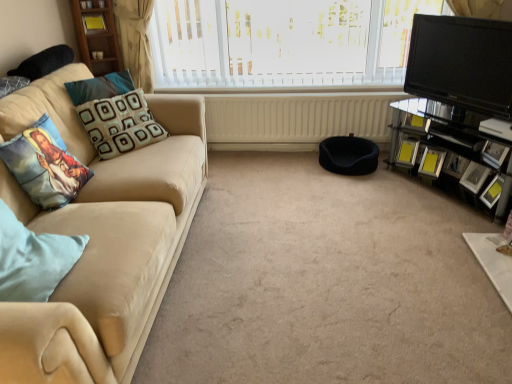
Question: From the image's perspective, does printed fabric pillow at left, placed as the 2th pillow when sorted from front to back, appear lower than matte black picture frame at right, which is the 3th picture frame from back to front?

Choices:
 (A) yes
 (B) no

Answer: (B)

Question: Is printed fabric pillow at left, placed as the 2th pillow when sorted from front to back, not close to matte black picture frame at right, which is the 3th picture frame from back to front?

Choices:
 (A) no
 (B) yes

Answer: (B)

Question: Is printed fabric pillow at left, placed as the 2th pillow when sorted from front to back, facing towards matte black picture frame at right, which is the 3th picture frame from back to front?

Choices:
 (A) yes
 (B) no

Answer: (A)

Question: Can you confirm if printed fabric pillow at left, acting as the second pillow starting from the back, is positioned to the right of matte black picture frame at right, which is the 3th picture frame from back to front?

Choices:
 (A) yes
 (B) no

Answer: (B)

Question: Does printed fabric pillow at left, acting as the second pillow starting from the back, have a greater height compared to matte black picture frame at right, which is the 3th picture frame from back to front?

Choices:
 (A) no
 (B) yes

Answer: (B)

Question: Is point (489, 185) closer or farther from the camera than point (501, 263)?

Choices:
 (A) closer
 (B) farther

Answer: (B)

Question: In the image, is yellow glossy picture frame at right, the fourth picture frame from the back, on the left side or the right side of white glossy table at lower right?

Choices:
 (A) left
 (B) right

Answer: (B)

Question: Is yellow glossy picture frame at right, acting as the second picture frame starting from the front, bigger or smaller than white glossy table at lower right?

Choices:
 (A) small
 (B) big

Answer: (A)

Question: Considering their positions, is yellow glossy picture frame at right, the fourth picture frame from the back, located in front of or behind white glossy table at lower right?

Choices:
 (A) front
 (B) behind

Answer: (B)

Question: Is beige fabric couch at left inside the boundaries of carpet at center, or outside?

Choices:
 (A) outside
 (B) inside

Answer: (A)

Question: From the image's perspective, is beige fabric couch at left positioned above or below carpet at center?

Choices:
 (A) below
 (B) above

Answer: (B)

Question: Does point (35, 311) appear closer or farther from the camera than point (224, 309)?

Choices:
 (A) farther
 (B) closer

Answer: (B)

Question: Considering the positions of beige fabric couch at left and carpet at center in the image, is beige fabric couch at left taller or shorter than carpet at center?

Choices:
 (A) short
 (B) tall

Answer: (B)

Question: Considering the positions of black fabric footrest at center and white textured blinds at upper center in the image, is black fabric footrest at center bigger or smaller than white textured blinds at upper center?

Choices:
 (A) big
 (B) small

Answer: (B)

Question: In the image, is black fabric footrest at center positioned in front of or behind white textured blinds at upper center?

Choices:
 (A) front
 (B) behind

Answer: (B)